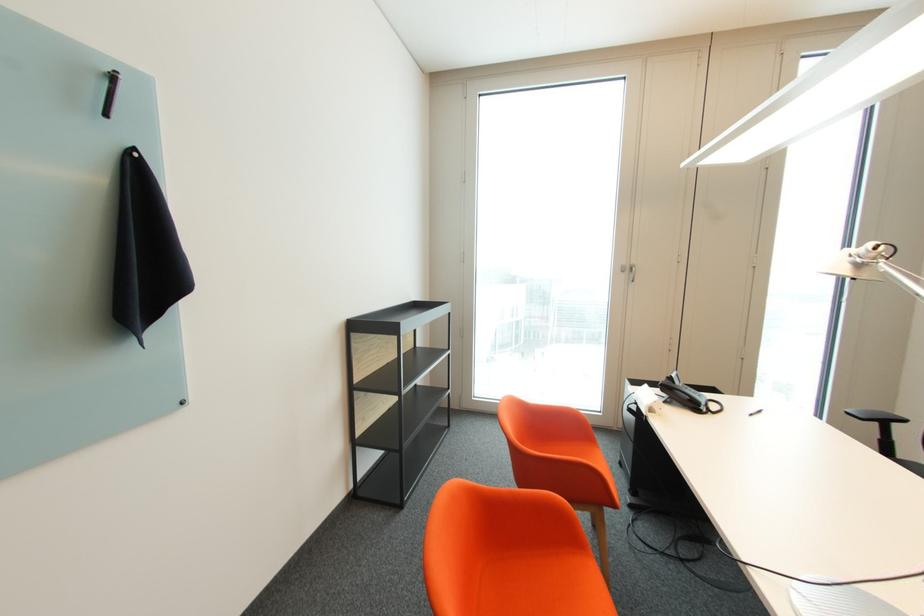
Where would you rest the black chair armrest? Please return your answer as a coordinate pair (x, y).

(874, 415)